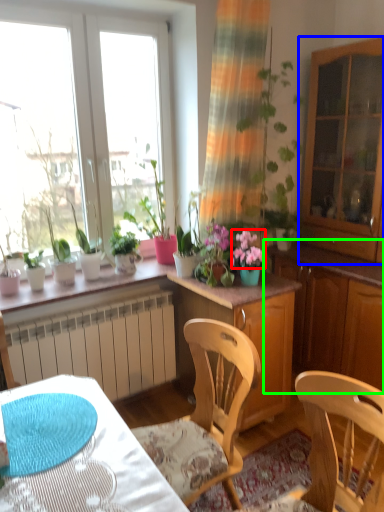
Question: Which object is the farthest from flower (highlighted by a red box)? Choose among these: cabinetry (highlighted by a blue box) or dresser (highlighted by a green box).

Choices:
 (A) cabinetry
 (B) dresser

Answer: (A)